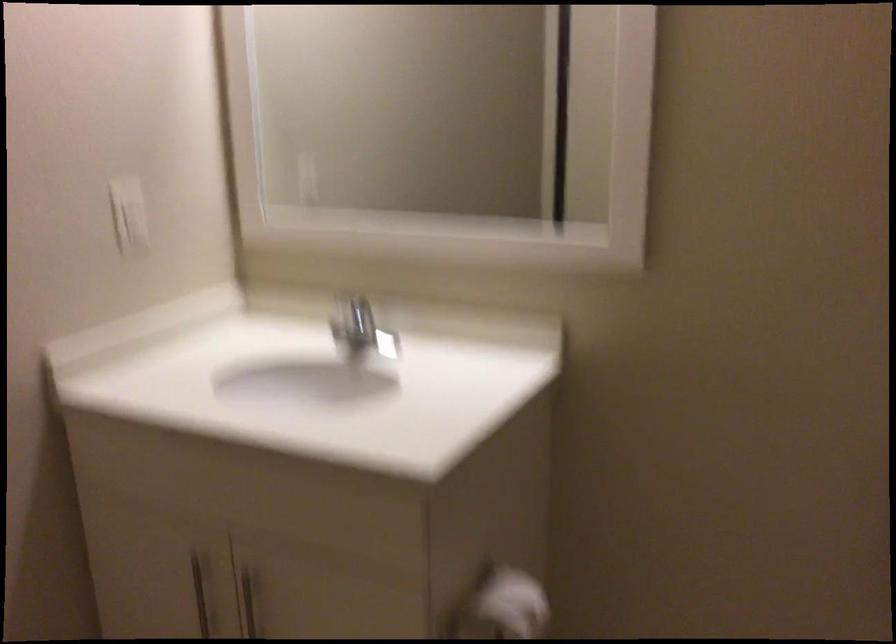
I want to click on white light switch, so (128, 214).